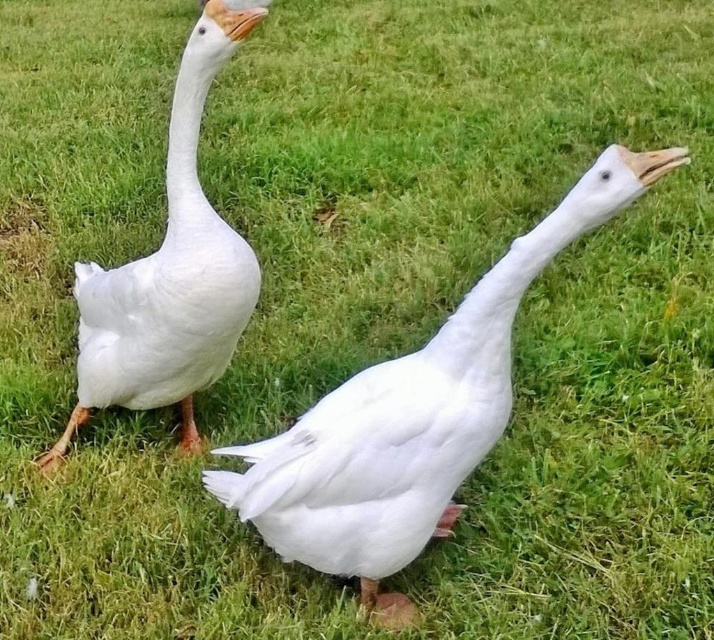
Which of these two, white matte duck at center or white matte duck at left, stands taller?

white matte duck at left is taller.

Based on the photo, is white matte duck at center positioned in front of white matte duck at left?

Yes, white matte duck at center is closer to the viewer.

The width and height of the screenshot is (714, 640). Describe the element at coordinates (413, 417) in the screenshot. I see `white matte duck at center` at that location.

You are a GUI agent. You are given a task and a screenshot of the screen. Output one action in this format:
    pyautogui.click(x=<x>, y=<y>)
    Task: Click on the white matte duck at center
    The height and width of the screenshot is (640, 714).
    Given the screenshot: What is the action you would take?
    pyautogui.click(x=413, y=417)